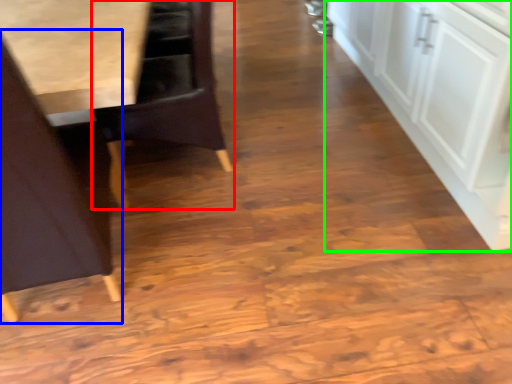
Question: Which object is the farthest from chair (highlighted by a red box)? Choose among these: chair (highlighted by a blue box) or cabinetry (highlighted by a green box).

Choices:
 (A) chair
 (B) cabinetry

Answer: (B)